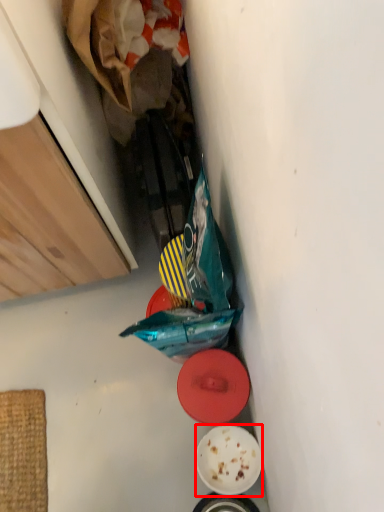
Question: Observing the image, what is the correct spatial positioning of plate (annotated by the red box) in reference to plate?

Choices:
 (A) right
 (B) left

Answer: (A)